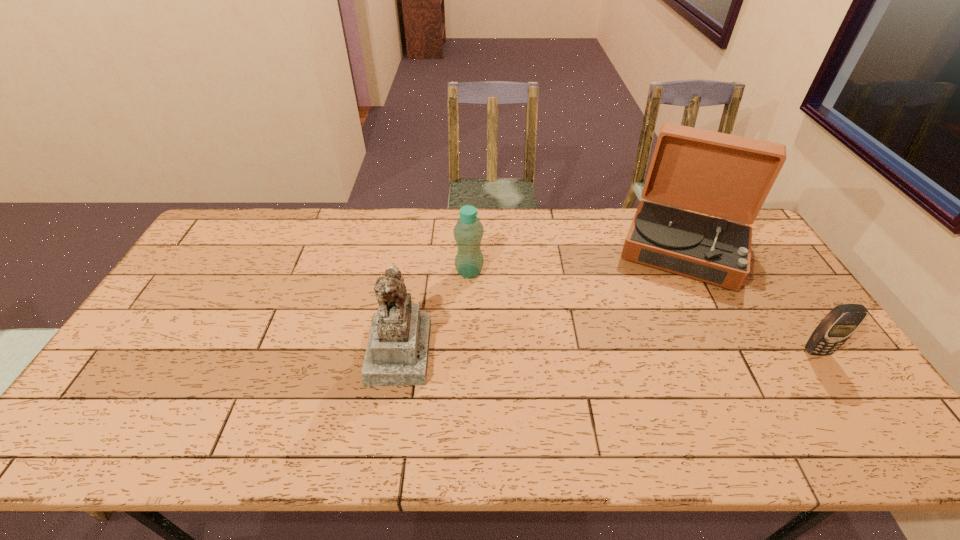
The height and width of the screenshot is (540, 960). Find the location of `free region at the left edge`. free region at the left edge is located at coordinates (184, 343).

The height and width of the screenshot is (540, 960). Identify the location of vacant point at the right edge. (796, 333).

What are the coordinates of `vacant area at the far left corner of the desktop` in the screenshot? It's located at (228, 228).

Identify the location of free space between the third object from right to left and the shortest object. This screenshot has width=960, height=540. (643, 312).

In order to click on free spot between the cellular telephone and the figurine in this screenshot , I will do `click(608, 351)`.

Locate an element on the screen. unoccupied area between the phonograph record and the leftmost object is located at coordinates (541, 299).

Find the location of a particular element. This screenshot has height=540, width=960. free space between the figurine and the phonograph record is located at coordinates (541, 299).

At what (x,y) coordinates should I click in order to perform the action: click on vacant area that lies between the figurine and the water bottle. Please return your answer as a coordinate pair (x, y). The height and width of the screenshot is (540, 960). Looking at the image, I should click on pos(434,311).

I want to click on free space that is in between the phonograph record and the cellular telephone, so click(750, 299).

At what (x,y) coordinates should I click in order to perform the action: click on vacant space in between the shortest object and the figurine. Please return your answer as a coordinate pair (x, y). The height and width of the screenshot is (540, 960). Looking at the image, I should click on (608, 351).